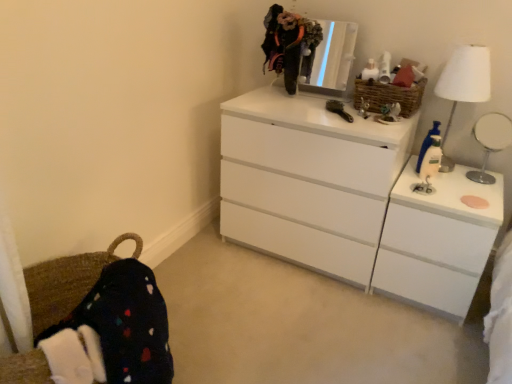
Identify the location of vacant region above metallic reflective mirror at upper center (from a real-world perspective). The width and height of the screenshot is (512, 384). (326, 21).